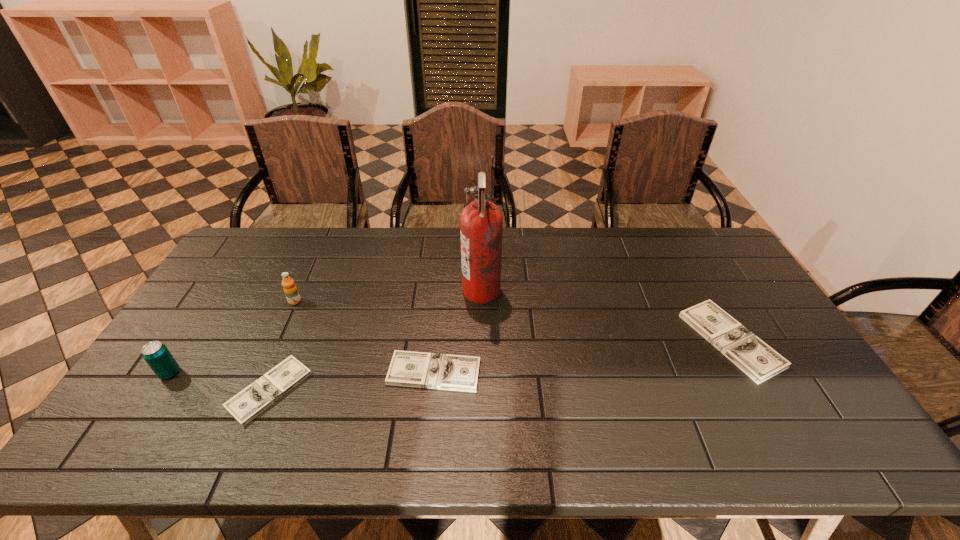
Locate an element on the screen. The height and width of the screenshot is (540, 960). the shortest object is located at coordinates (246, 405).

This screenshot has height=540, width=960. In order to click on the leftmost dollar in this screenshot , I will do `click(246, 405)`.

Locate an element on the screen. The width and height of the screenshot is (960, 540). the second dollar from left to right is located at coordinates (411, 369).

This screenshot has height=540, width=960. I want to click on the second tallest dollar, so click(411, 369).

Locate an element on the screen. This screenshot has height=540, width=960. the rightmost dollar is located at coordinates (759, 361).

In order to click on orange juice in this screenshot , I will do `click(289, 287)`.

I want to click on beer can, so click(158, 357).

Find the location of a particular element. The height and width of the screenshot is (540, 960). the tallest object is located at coordinates (481, 223).

At what (x,y) coordinates should I click in order to perform the action: click on vacant area situated on the left of the shortest dollar. Please return your answer as a coordinate pair (x, y). Looking at the image, I should click on (178, 390).

Image resolution: width=960 pixels, height=540 pixels. I want to click on free space located 0.130m on the left of the second dollar from right to left, so click(x=339, y=373).